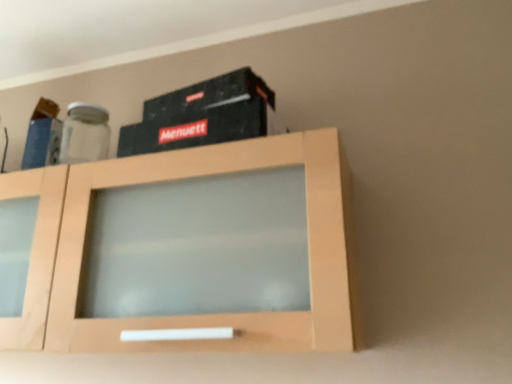
Question: Would you consider black matte box at upper center to be distant from light wood cabinet at center?

Choices:
 (A) no
 (B) yes

Answer: (A)

Question: Does black matte box at upper center appear on the left side of light wood cabinet at center?

Choices:
 (A) no
 (B) yes

Answer: (A)

Question: Does black matte box at upper center come in front of light wood cabinet at center?

Choices:
 (A) yes
 (B) no

Answer: (B)

Question: Is black matte box at upper center thinner than light wood cabinet at center?

Choices:
 (A) yes
 (B) no

Answer: (A)

Question: Is black matte box at upper center aimed at light wood cabinet at center?

Choices:
 (A) yes
 (B) no

Answer: (B)

Question: Is light wood cabinet at center at the back of black matte box at upper center?

Choices:
 (A) yes
 (B) no

Answer: (B)

Question: From the image's perspective, is light wood cabinet at center located beneath black matte box at upper center?

Choices:
 (A) yes
 (B) no

Answer: (A)

Question: From a real-world perspective, is light wood cabinet at center positioned over black matte box at upper center based on gravity?

Choices:
 (A) no
 (B) yes

Answer: (A)

Question: Is light wood cabinet at center positioned with its back to black matte box at upper center?

Choices:
 (A) no
 (B) yes

Answer: (A)

Question: Is black matte box at upper center a part of light wood cabinet at center?

Choices:
 (A) yes
 (B) no

Answer: (B)

Question: Considering the relative sizes of light wood cabinet at center and black matte box at upper center in the image provided, is light wood cabinet at center bigger than black matte box at upper center?

Choices:
 (A) yes
 (B) no

Answer: (A)

Question: Is light wood cabinet at center positioned beyond the bounds of black matte box at upper center?

Choices:
 (A) yes
 (B) no

Answer: (A)

Question: From a real-world perspective, is black matte box at upper center above or below light wood cabinet at center?

Choices:
 (A) below
 (B) above

Answer: (B)